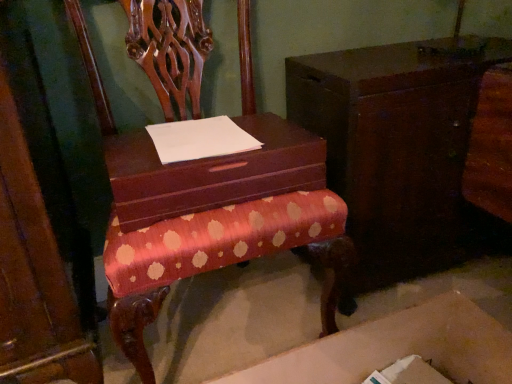
Question: Is cardboard box at lower center wider than polished wood chair at center?

Choices:
 (A) no
 (B) yes

Answer: (A)

Question: Is cardboard box at lower center smaller than polished wood chair at center?

Choices:
 (A) no
 (B) yes

Answer: (B)

Question: Is polished wood chair at center surrounded by cardboard box at lower center?

Choices:
 (A) yes
 (B) no

Answer: (B)

Question: Does cardboard box at lower center have a greater height compared to polished wood chair at center?

Choices:
 (A) yes
 (B) no

Answer: (B)

Question: Is cardboard box at lower center at the left side of polished wood chair at center?

Choices:
 (A) yes
 (B) no

Answer: (B)

Question: Considering the relative positions of cardboard box at lower center and polished wood chair at center in the image provided, is cardboard box at lower center in front of polished wood chair at center?

Choices:
 (A) yes
 (B) no

Answer: (B)

Question: From a real-world perspective, is polished wood chair at center under cardboard box at lower center?

Choices:
 (A) no
 (B) yes

Answer: (A)

Question: Considering the relative sizes of polished wood chair at center and cardboard box at lower center in the image provided, is polished wood chair at center thinner than cardboard box at lower center?

Choices:
 (A) no
 (B) yes

Answer: (A)

Question: Does polished wood chair at center turn towards cardboard box at lower center?

Choices:
 (A) no
 (B) yes

Answer: (B)

Question: Is polished wood chair at center positioned far away from cardboard box at lower center?

Choices:
 (A) no
 (B) yes

Answer: (A)

Question: Is polished wood chair at center further to the viewer compared to cardboard box at lower center?

Choices:
 (A) no
 (B) yes

Answer: (A)

Question: Is polished wood chair at center in front of cardboard box at lower center?

Choices:
 (A) no
 (B) yes

Answer: (B)

Question: Is matte brown shoe box at center shorter than white paper at center?

Choices:
 (A) no
 (B) yes

Answer: (A)